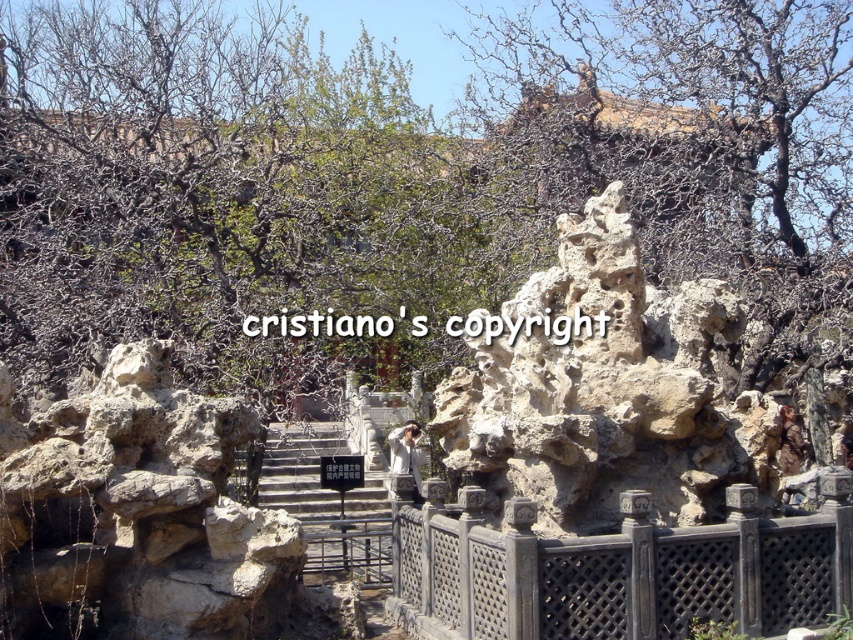
From the picture: You are standing in a traditional Chinese garden and want to take a photo of both the natural stone rock formation at center and the stone stairs at center. Which object should you focus on first to ensure both are in the frame?

You should focus on the natural stone rock formation at center first since it is closer to you than the stone stairs at center, ensuring both are in the frame by adjusting the camera angle accordingly.